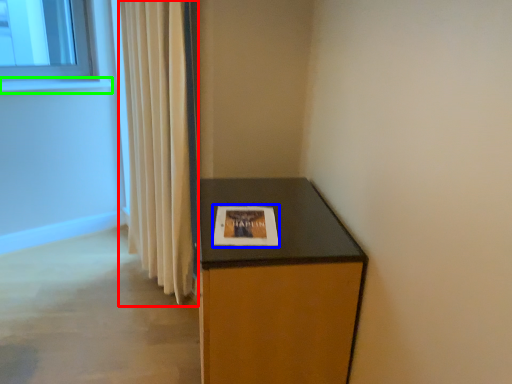
Question: Which is nearer to the curtain (highlighted by a red box)? picture frame (highlighted by a blue box) or window sill (highlighted by a green box).

Choices:
 (A) picture frame
 (B) window sill

Answer: (A)